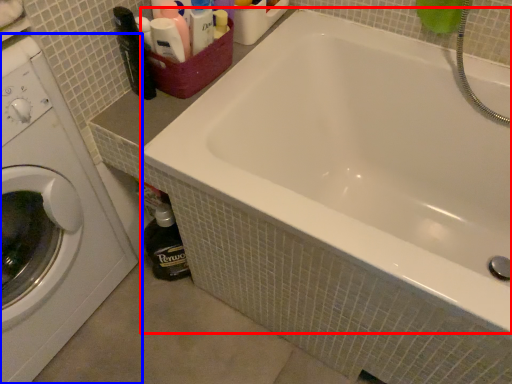
Question: Which object appears farthest to the camera in this image, bathtub (highlighted by a red box) or washing machine (highlighted by a blue box)?

Choices:
 (A) bathtub
 (B) washing machine

Answer: (A)